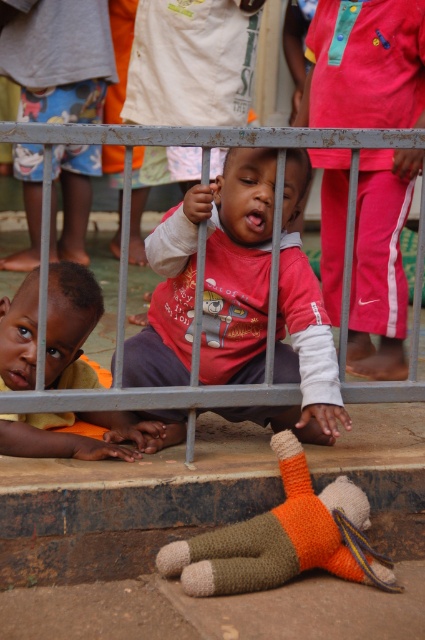
You are a photographer trying to capture a closeup of the matte red shirt at center and the knitted orange doll at lower center in the scene. Given that your camera lens can focus on objects within a 20 inch range, will you be able to capture both subjects clearly in the same shot?

The matte red shirt at center and knitted orange doll at lower center are 22.91 inches apart, which exceeds the camera lens focus range of 20 inches. Therefore, you cannot capture both subjects clearly in the same shot.

You are a photographer trying to capture a group photo of the matte red shirt at center and the orange fabric shirt at lower left. You want to ensure both shirts are fully visible in the frame. Which shirt requires a wider angle to accommodate its width?

The matte red shirt at center requires a wider angle because its width surpasses that of the orange fabric shirt at lower left, necessitating more space in the frame to fully capture it.